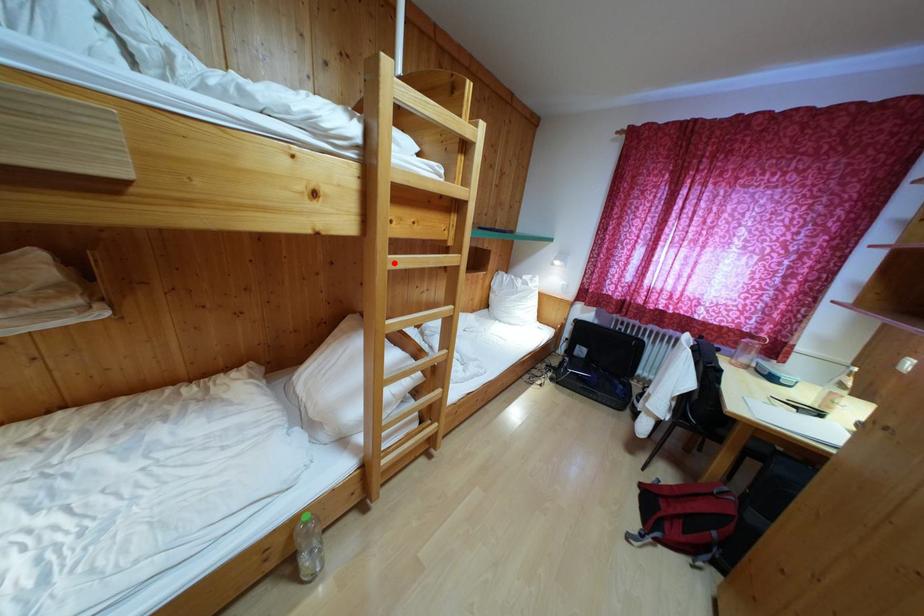
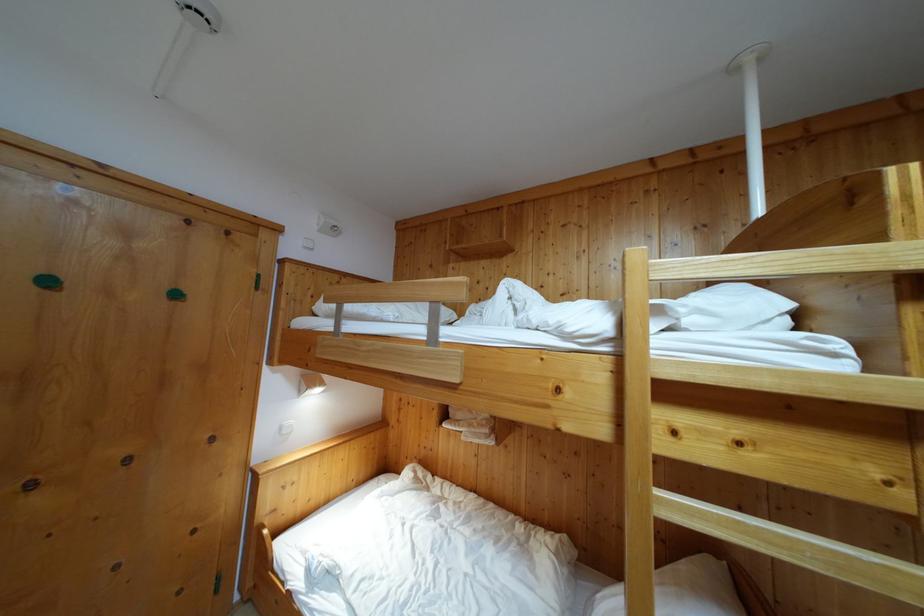
The point at the highlighted location is marked in the first image. Where is the corresponding point in the second image?

(663, 500)